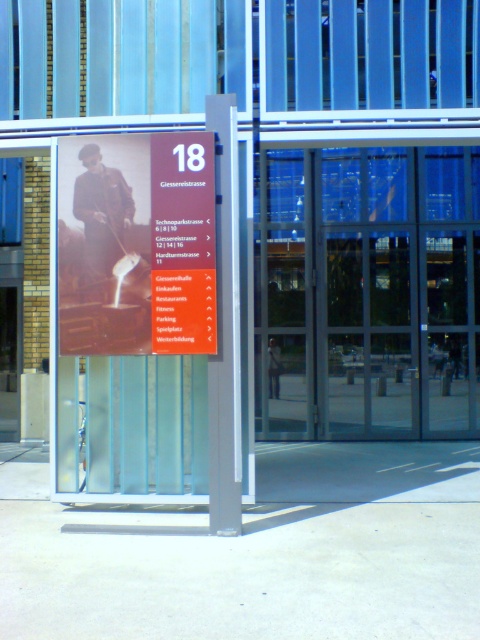
Question: Is transparent glass door at center wider than orange glossy sign at center?

Choices:
 (A) yes
 (B) no

Answer: (A)

Question: Does matte brown poster at center appear on the right side of orange glossy sign at center?

Choices:
 (A) no
 (B) yes

Answer: (A)

Question: Which is farther from the matte brown poster at center?

Choices:
 (A) transparent glass door at center
 (B) orange glossy sign at center

Answer: (A)

Question: Which object is the farthest from the orange glossy sign at center?

Choices:
 (A) transparent glass door at center
 (B) matte brown poster at center

Answer: (A)

Question: Can you confirm if matte brown poster at center is positioned to the right of orange glossy sign at center?

Choices:
 (A) yes
 (B) no

Answer: (B)

Question: Which object appears closest to the camera in this image?

Choices:
 (A) transparent glass door at center
 (B) matte brown poster at center

Answer: (B)